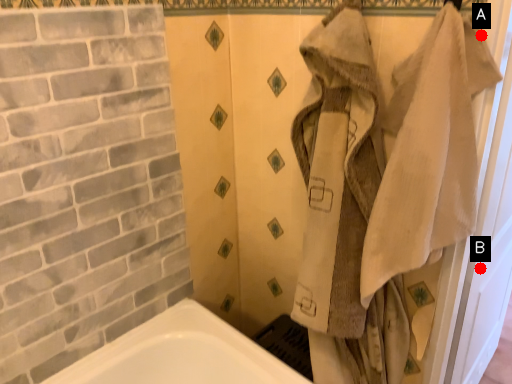
Question: Two points are circled on the image, labeled by A and B beside each circle. Which point is further to the camera?

Choices:
 (A) A is further
 (B) B is further

Answer: (B)